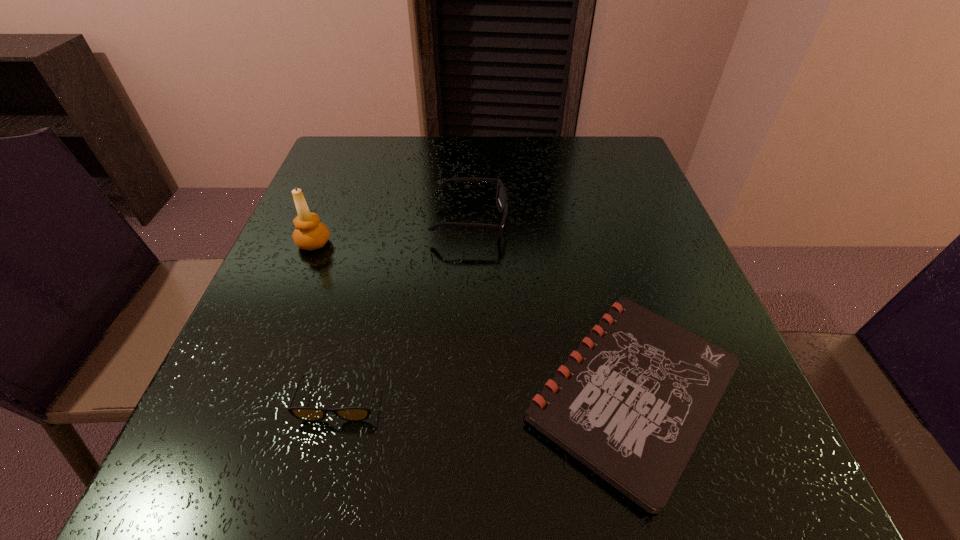
Where is `free point at the right edge`? The height and width of the screenshot is (540, 960). free point at the right edge is located at coordinates (745, 382).

This screenshot has width=960, height=540. Find the location of `vacant space at the far left corner of the desktop`. vacant space at the far left corner of the desktop is located at coordinates (388, 146).

The image size is (960, 540). In the image, there is a desktop. What are the coordinates of `vacant space at the far right corner` in the screenshot? It's located at (596, 180).

Image resolution: width=960 pixels, height=540 pixels. Identify the location of vacant space at the near right corner. (731, 512).

Find the location of a particular element. The width and height of the screenshot is (960, 540). unoccupied area between the candle_holder and the farther sunglasses is located at coordinates (392, 232).

Locate an element on the screen. vacant area between the shortest object and the candle_holder is located at coordinates (473, 318).

Image resolution: width=960 pixels, height=540 pixels. In order to click on unoccupied area between the taller sunglasses and the leftmost object in this screenshot , I will do `click(392, 232)`.

Where is `vacant space that's between the third object from left to right and the rightmost object`? This screenshot has width=960, height=540. vacant space that's between the third object from left to right and the rightmost object is located at coordinates (550, 306).

Locate an element on the screen. The height and width of the screenshot is (540, 960). free space between the third tallest object and the candle_holder is located at coordinates (326, 322).

You are a GUI agent. You are given a task and a screenshot of the screen. Output one action in this format:
    pyautogui.click(x=<x>, y=<y>)
    Task: Click on the vacant space in between the leftmost object and the taller sunglasses
    The height and width of the screenshot is (540, 960).
    Given the screenshot: What is the action you would take?
    pyautogui.click(x=392, y=232)